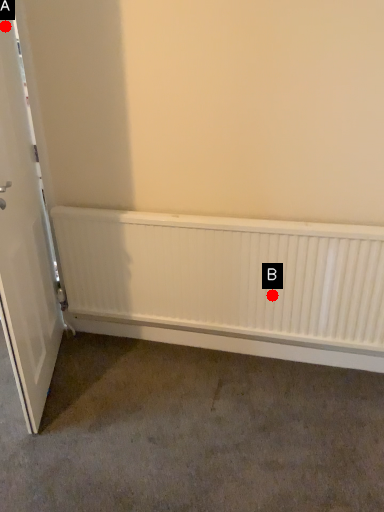
Question: Two points are circled on the image, labeled by A and B beside each circle. Which of the following is the farthest from the observer?

Choices:
 (A) A is further
 (B) B is further

Answer: (B)